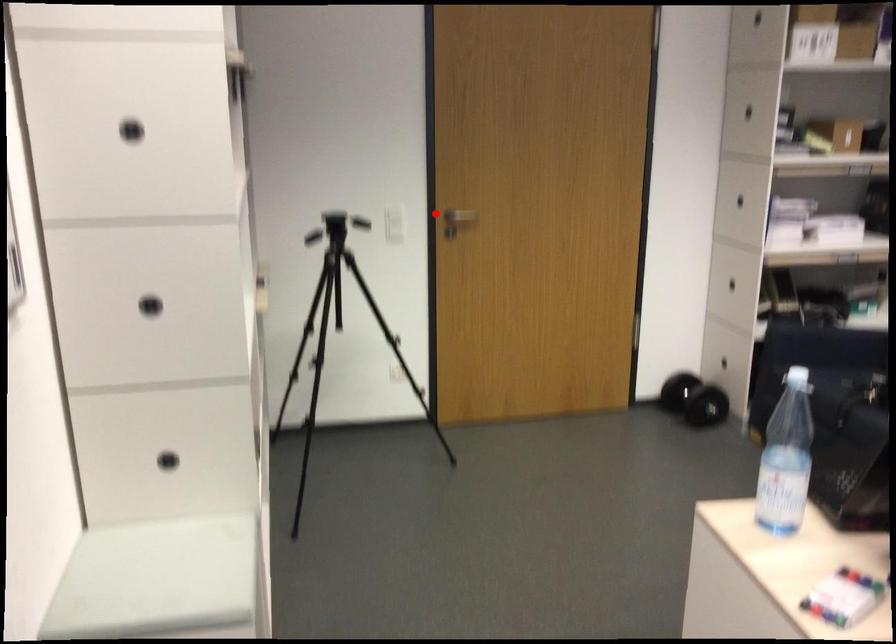
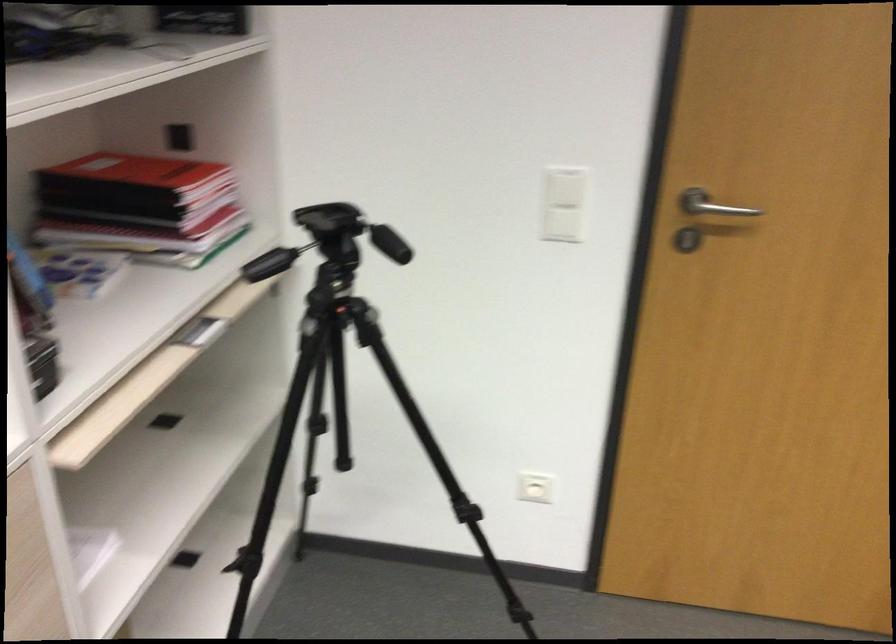
The point at the highlighted location is marked in the first image. Where is the corresponding point in the second image?

(711, 205)